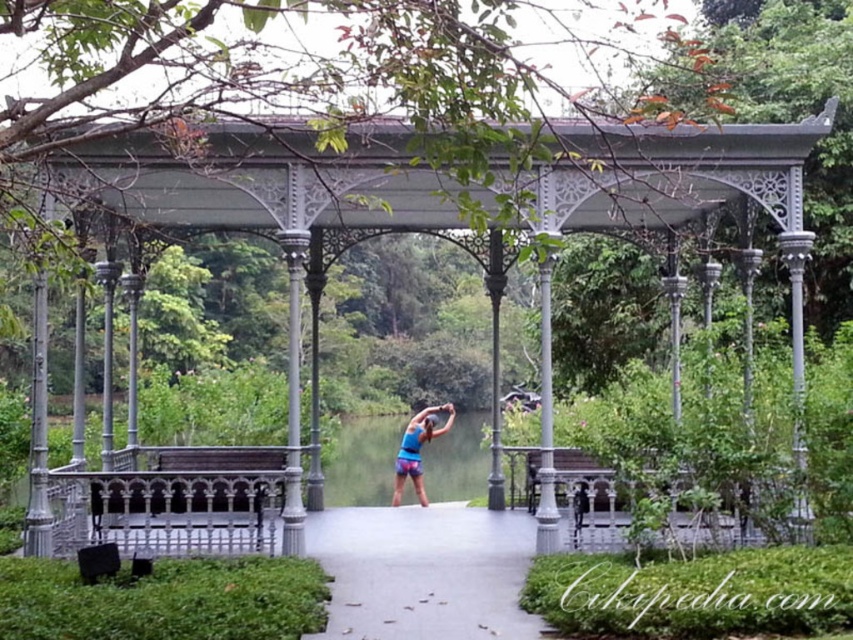
Question: Which is farther from the gray concrete path at center?

Choices:
 (A) blue fabric shorts at center
 (B) wooden bench at center
 (C) clear water at center
 (D) metallic gazebo at center

Answer: (C)

Question: Considering the relative positions of wooden bench at center and blue fabric shorts at center in the image provided, where is wooden bench at center located with respect to blue fabric shorts at center?

Choices:
 (A) left
 (B) right

Answer: (A)

Question: Is gray concrete path at center further to camera compared to blue fabric shorts at center?

Choices:
 (A) no
 (B) yes

Answer: (A)

Question: Does metallic gazebo at center come behind gray concrete path at center?

Choices:
 (A) no
 (B) yes

Answer: (B)

Question: Which object is farther from the camera taking this photo?

Choices:
 (A) wooden bench at center
 (B) blue fabric shorts at center

Answer: (B)

Question: Which object is farther from the camera taking this photo?

Choices:
 (A) wooden bench at center
 (B) gray concrete path at center
 (C) metallic gazebo at center

Answer: (C)